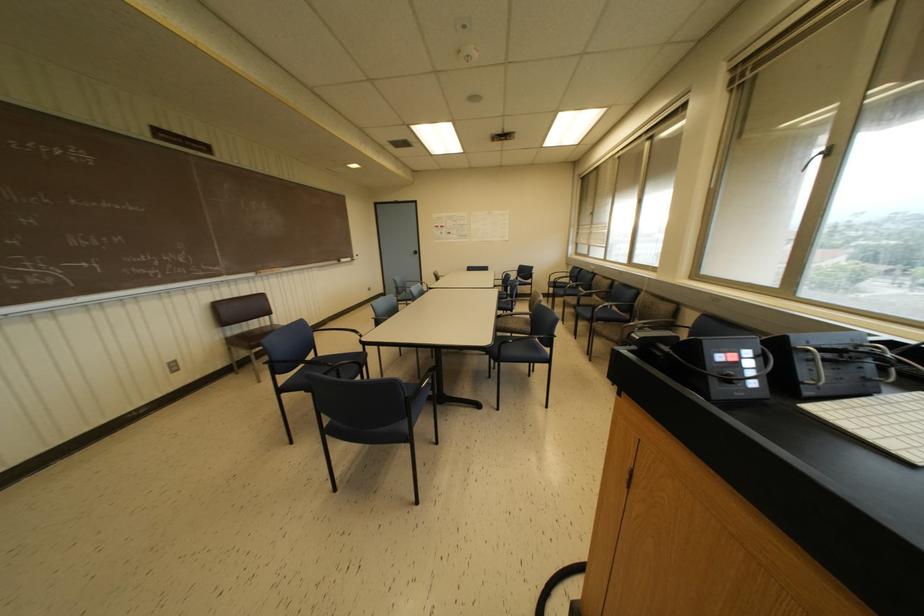
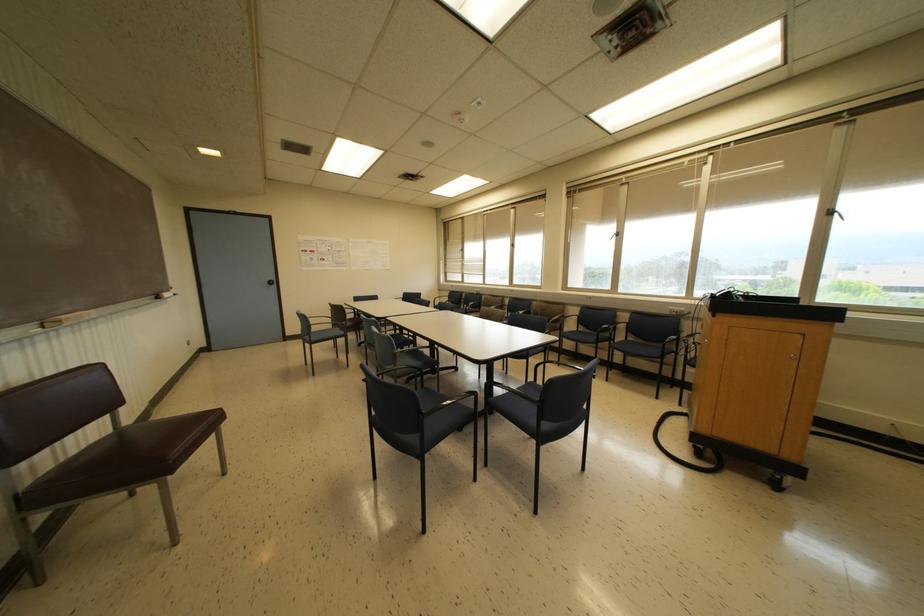
Locate, in the second image, the point that corresponds to (272,325) in the first image.

(118, 430)